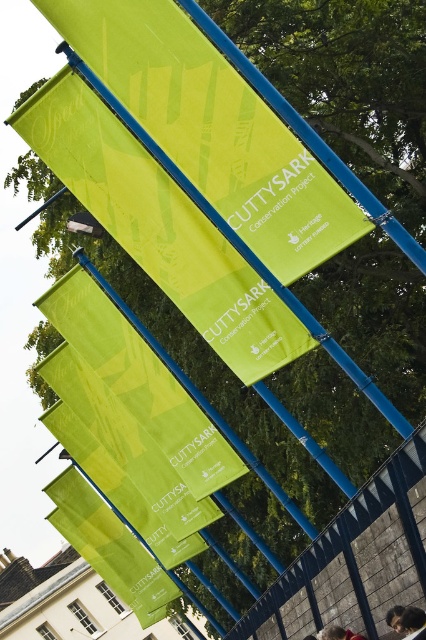
You are at an outdoor event and see the green fabric banner at center and the blue metal fence at center. From your perspective, which object is positioned to the left?

The green fabric banner at center is positioned to the left of the blue metal fence at center.

You are a photographer setting up a shot of the green fabric banner at center and the blue metal fence at center. Which object should you focus on first if you want to capture both in a single frame without moving the camera?

The green fabric banner at center is not as tall as the blue metal fence at center, so you should focus on the blue metal fence at center first to ensure it fits within the frame.